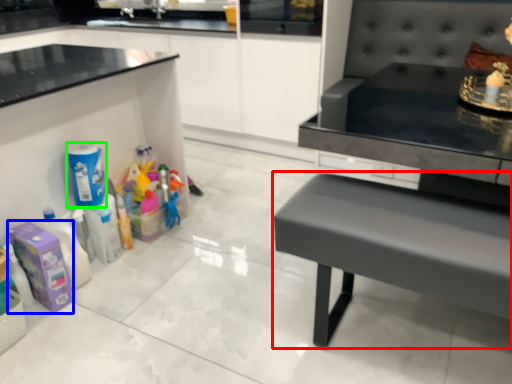
Question: Based on their relative distances, which object is nearer to table (highlighted by a red box)? Choose from cleaning product (highlighted by a blue box) and cleaning product (highlighted by a green box).

Choices:
 (A) cleaning product
 (B) cleaning product

Answer: (A)